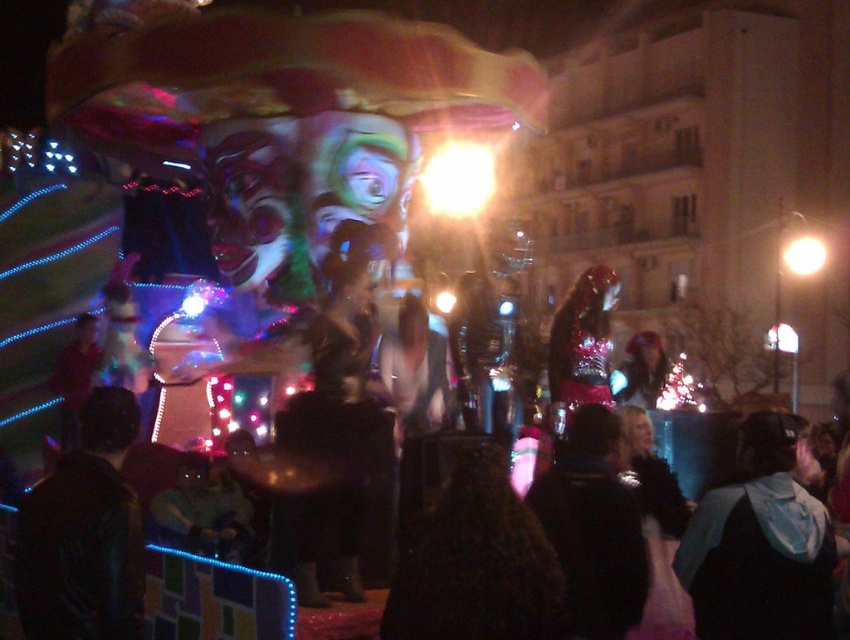
You are a photographer standing at the base of the float, aiming to capture the black leather jacket at lower right and the bright white bulb at upper right in the same frame. Given that your camera has a maximum focal length of 50 meters, will you be able to adjust your lens to include both objects in the shot?

The black leather jacket at lower right is 104.66 meters from the bright white bulb at upper right. Since your camera has a maximum focal length of 50 meters, you won

You are a photographer trying to capture the festive float. You notice the leather jacket at lower left and the bright white bulb at upper right in your viewfinder. Which object should you focus on if you want to capture the wider subject?

The leather jacket at lower left should be focused on since its width is larger than the bright white bulb at upper right.